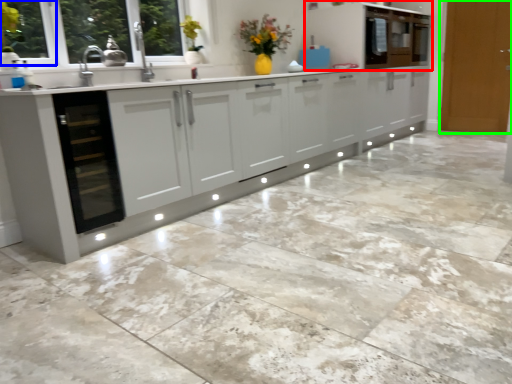
Question: Based on their relative distances, which object is nearer to cabinetry (highlighted by a red box)? Choose from window frame (highlighted by a blue box) and door (highlighted by a green box).

Choices:
 (A) window frame
 (B) door

Answer: (B)